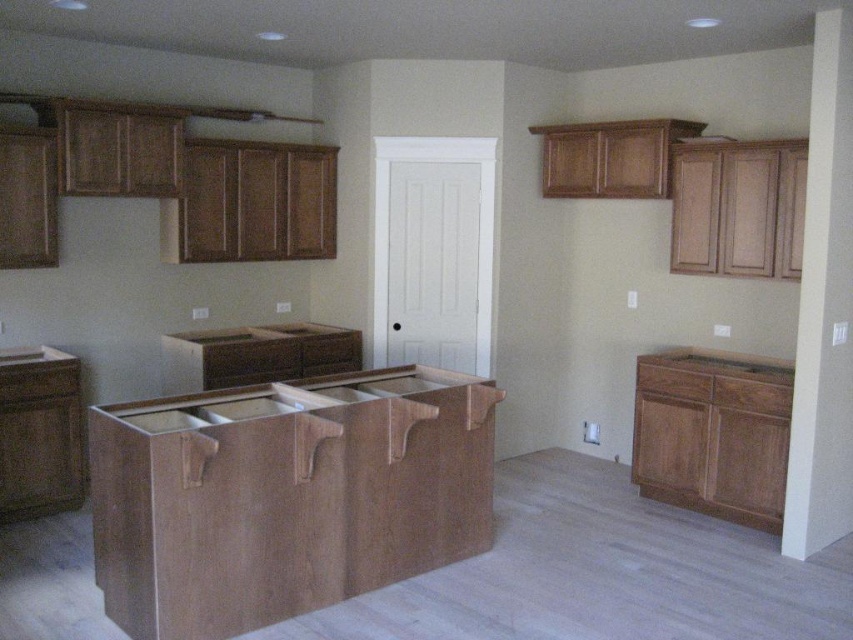
Question: Can you confirm if wooden at center is bigger than wooden drawer at right?

Choices:
 (A) no
 (B) yes

Answer: (B)

Question: Which of these objects is positioned closest to the natural wood counter at center?

Choices:
 (A) walnut wood drawer at right
 (B) wooden drawer at center

Answer: (B)

Question: Which object is positioned farthest from the wooden at center?

Choices:
 (A) walnut wood drawer at right
 (B) wooden drawer at right

Answer: (A)

Question: Considering the relative positions of wooden at center and wooden drawer at right in the image provided, where is wooden at center located with respect to wooden drawer at right?

Choices:
 (A) above
 (B) below

Answer: (A)

Question: Which of these objects is positioned farthest from the natural wood counter at center?

Choices:
 (A) walnut wood drawer at right
 (B) wooden drawer at center
 (C) wooden at center
 (D) wooden drawer at right

Answer: (A)

Question: Can you confirm if wooden at center is positioned below wooden drawer at center?

Choices:
 (A) yes
 (B) no

Answer: (A)